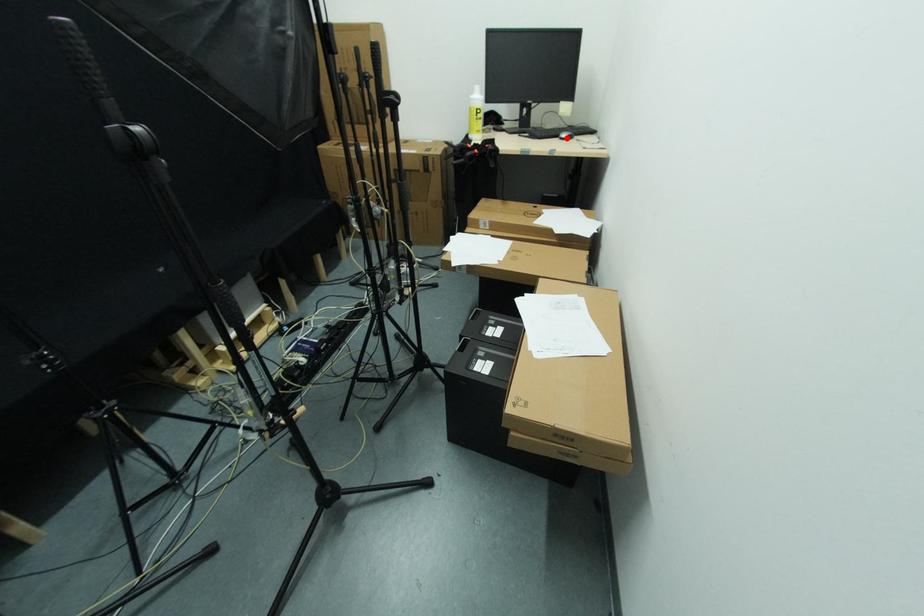
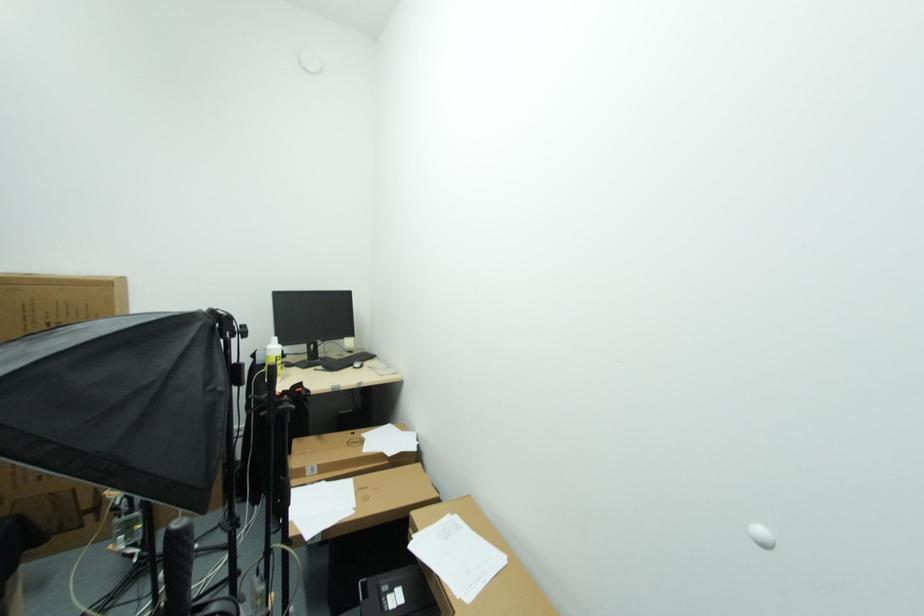
Where in the second image is the point corresponding to the highlighted location from the first image?

(359, 368)